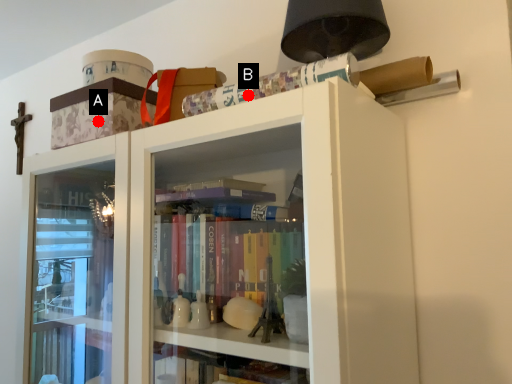
Question: Two points are circled on the image, labeled by A and B beside each circle. Which point appears closest to the camera in this image?

Choices:
 (A) A is closer
 (B) B is closer

Answer: (B)